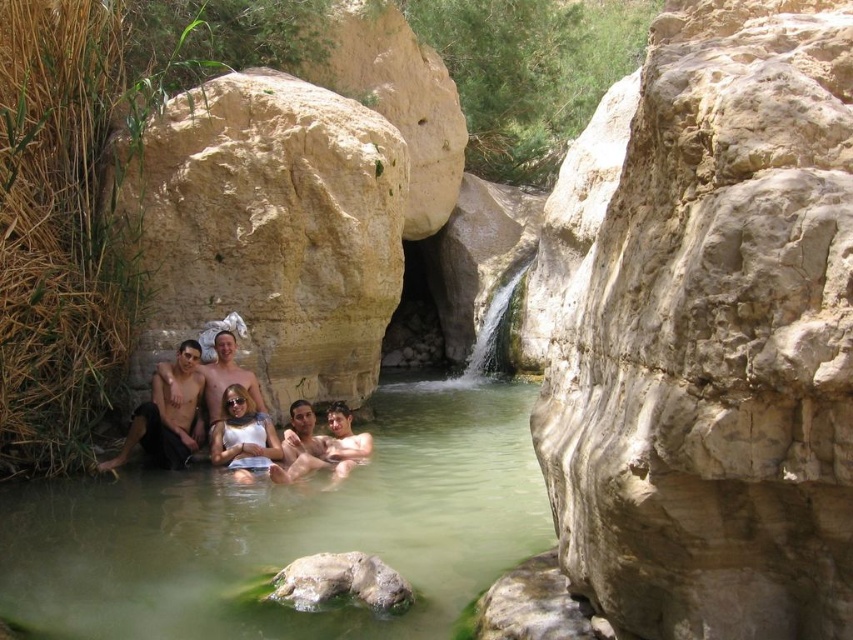
Does smooth skin man at left appear under smooth tan skin at center?

Indeed, smooth skin man at left is positioned under smooth tan skin at center.

Which is behind, point (165, 413) or point (212, 371)?

Point (212, 371)

Identify the location of smooth skin man at left. The width and height of the screenshot is (853, 640). (166, 416).

Who is higher up, green translucent water at center or smooth skin man at left?

smooth skin man at left is higher up.

Between green translucent water at center and smooth skin man at left, which one appears on the right side from the viewer's perspective?

Positioned to the right is green translucent water at center.

Between point (16, 620) and point (144, 435), which one is positioned behind?

Positioned behind is point (144, 435).

Locate an element on the screen. The image size is (853, 640). green translucent water at center is located at coordinates (285, 531).

Does smooth skin man at center appear on the left side of smooth tan skin at center?

In fact, smooth skin man at center is to the right of smooth tan skin at center.

Which is more to the left, smooth skin man at center or smooth tan skin at center?

Positioned to the left is smooth tan skin at center.

Describe the element at coordinates (320, 444) in the screenshot. I see `smooth skin man at center` at that location.

Locate an element on the screen. The image size is (853, 640). smooth skin man at center is located at coordinates (320, 444).